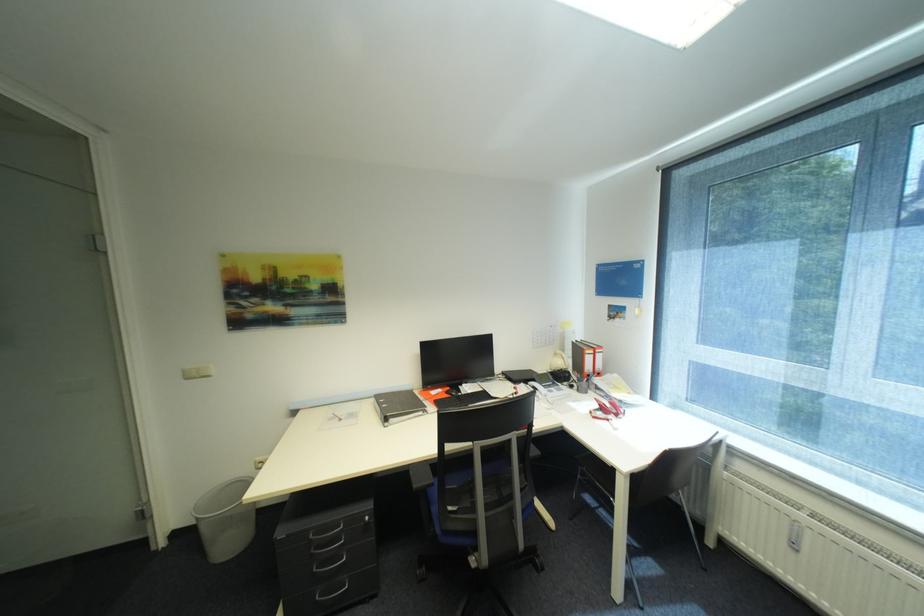
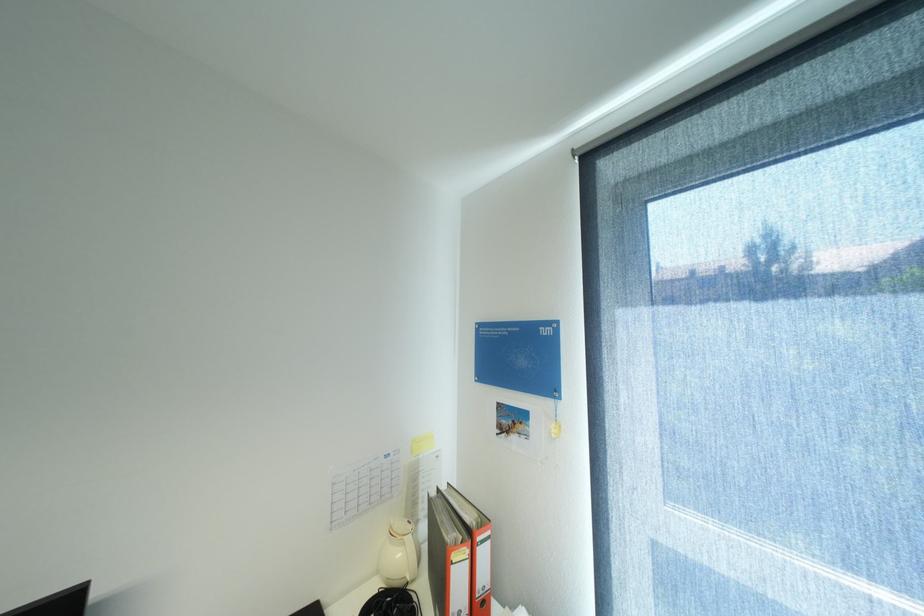
In the second image, find the point that corresponds to [567,363] in the first image.

(407, 554)